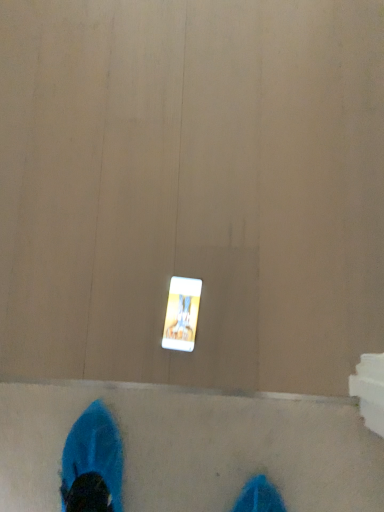
Locate an element on the screen. Image resolution: width=384 pixels, height=512 pixels. free location to the left of white glossy mobile phone at center is located at coordinates (114, 334).